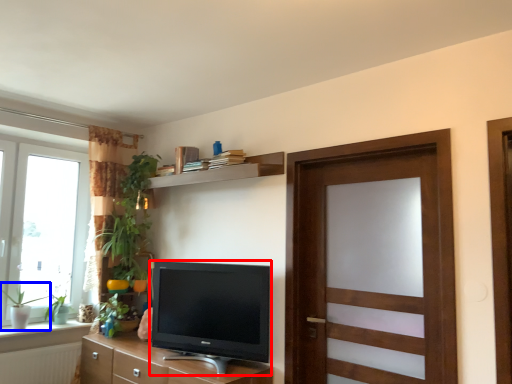
Question: Which object is closer to the camera taking this photo, television (highlighted by a red box) or plant (highlighted by a blue box)?

Choices:
 (A) television
 (B) plant

Answer: (A)